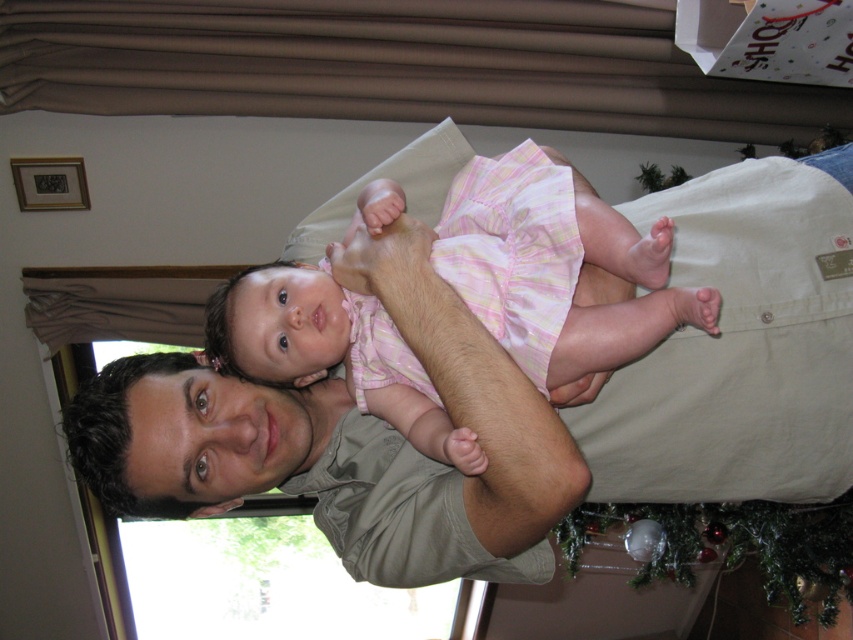
Can you confirm if matte khaki shirt at center is positioned above pink plaid dress at center?

No, matte khaki shirt at center is not above pink plaid dress at center.

Is point (728, 272) more distant than point (252, 276)?

Yes, point (728, 272) is behind point (252, 276).

Locate an element on the screen. Image resolution: width=853 pixels, height=640 pixels. matte khaki shirt at center is located at coordinates (524, 394).